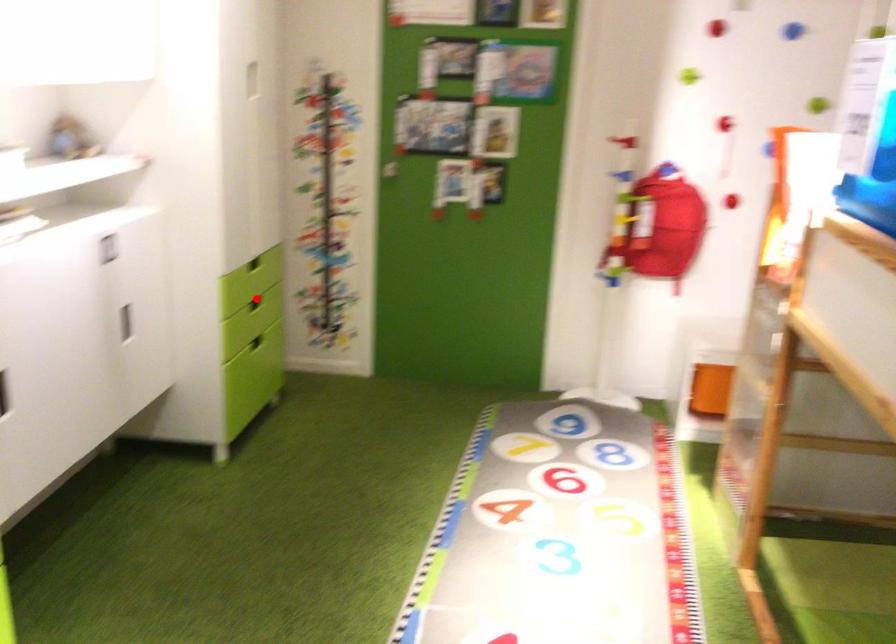
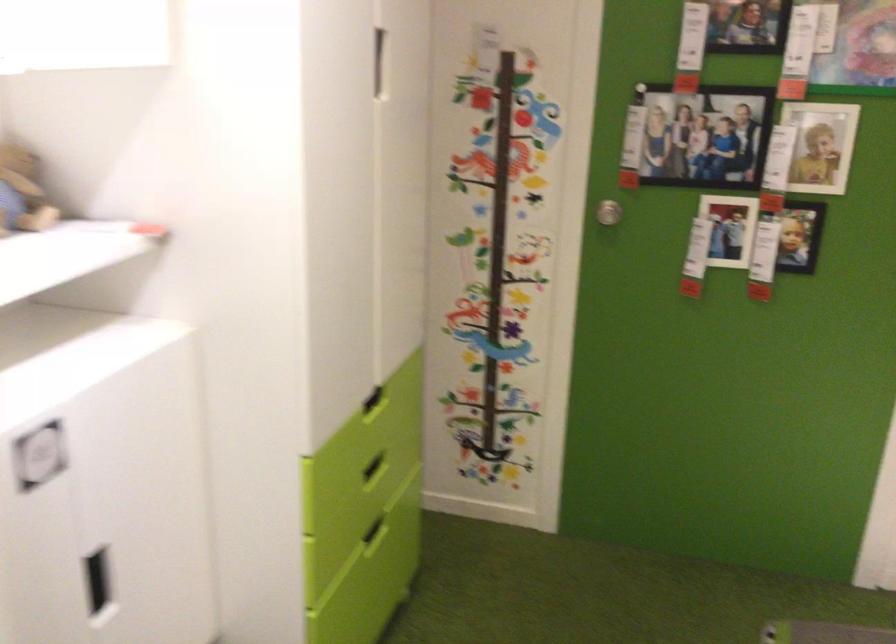
Question: I am providing you with two images of the same scene from different viewpoints. In image1, a red point is highlighted. Considering the same 3D point in image2, which of the following is correct?

Choices:
 (A) It is closer
 (B) It is farther

Answer: (A)